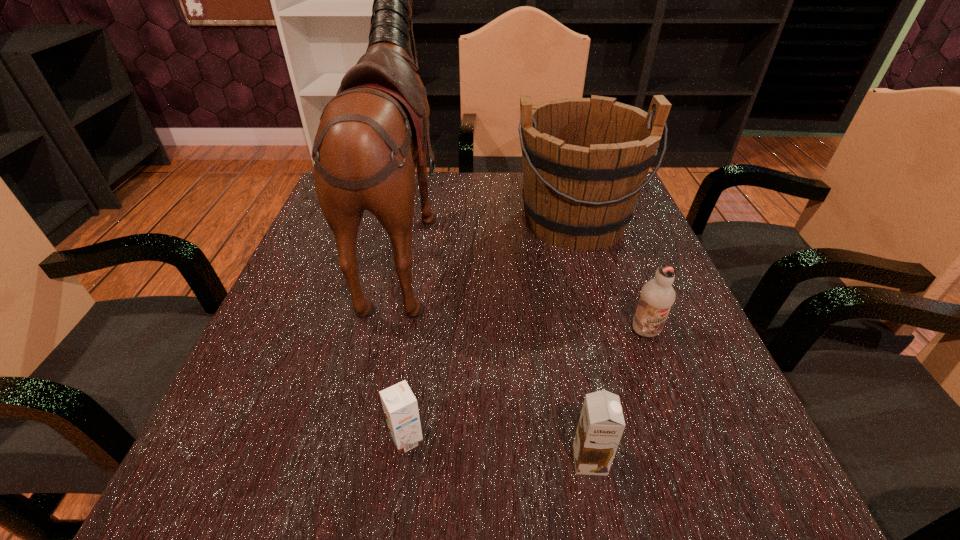
The width and height of the screenshot is (960, 540). I want to click on free space between the farthest chocolate milk and the tallest object, so click(525, 286).

Find the location of a particular element. blank region between the shortest chocolate milk and the second chocolate milk from left to right is located at coordinates (498, 450).

This screenshot has height=540, width=960. Identify the location of unoccupied area between the shortest chocolate milk and the wine bucket. (491, 330).

Select which object appears as the closest to the rightmost chocolate milk. Please provide its 2D coordinates. Your answer should be formatted as a tuple, i.e. [(x, y)], where the tuple contains the x and y coordinates of a point satisfying the conditions above.

[(585, 160)]

Locate which object is the fourth closest to the second chocolate milk from left to right. Please provide its 2D coordinates. Your answer should be formatted as a tuple, i.e. [(x, y)], where the tuple contains the x and y coordinates of a point satisfying the conditions above.

[(585, 160)]

Point out which chocolate milk is positioned as the third nearest to the wine bucket. Please provide its 2D coordinates. Your answer should be formatted as a tuple, i.e. [(x, y)], where the tuple contains the x and y coordinates of a point satisfying the conditions above.

[(601, 424)]

The width and height of the screenshot is (960, 540). Find the location of `the second closest chocolate milk to the second chocolate milk from right to left`. the second closest chocolate milk to the second chocolate milk from right to left is located at coordinates (657, 296).

Find the location of a particular element. Image resolution: width=960 pixels, height=540 pixels. free point that satisfies the following two spatial constraints: 1. on the back side of the rightmost chocolate milk; 2. on the right side of the second chocolate milk from right to left is located at coordinates (564, 332).

At what (x,y) coordinates should I click in order to perform the action: click on vacant region that satisfies the following two spatial constraints: 1. on the side of the fourth shortest object with the handle for carrying; 2. on the back of the tallest object. Please return your answer as a coordinate pair (x, y). Looking at the image, I should click on (581, 239).

Locate an element on the screen. Image resolution: width=960 pixels, height=540 pixels. blank space that satisfies the following two spatial constraints: 1. on the side of the fourth shortest object with the handle for carrying; 2. on the left side of the farthest chocolate milk is located at coordinates click(608, 332).